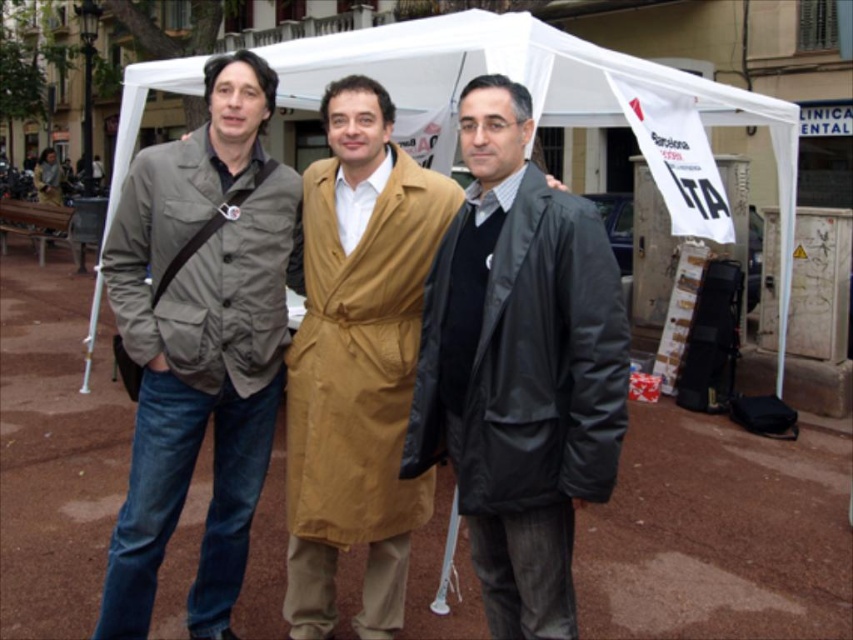
Question: Observing the image, what is the correct spatial positioning of matte black coat at center in reference to white fabric canopy at center?

Choices:
 (A) left
 (B) right

Answer: (A)

Question: Does matte black coat at center appear on the left side of matte gray jacket at left?

Choices:
 (A) yes
 (B) no

Answer: (B)

Question: Among these points, which one is nearest to the camera?

Choices:
 (A) (222, 592)
 (B) (294, 56)
 (C) (556, 385)
 (D) (326, 115)

Answer: (C)

Question: Which point is closer to the camera taking this photo?

Choices:
 (A) (231, 209)
 (B) (782, 168)

Answer: (A)

Question: Does matte black coat at center have a larger size compared to white fabric canopy at center?

Choices:
 (A) no
 (B) yes

Answer: (B)

Question: Which of the following is the closest to the observer?

Choices:
 (A) matte black coat at center
 (B) tan/waterproof trench coat at center
 (C) matte gray jacket at left

Answer: (A)